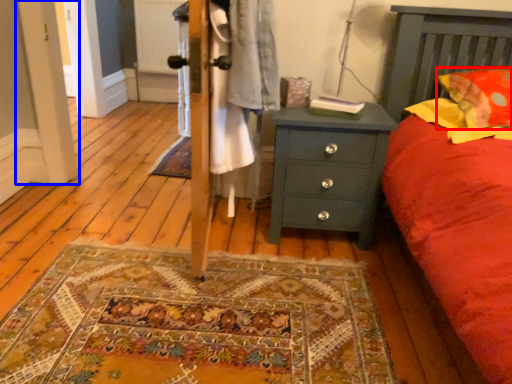
Question: Which object is closer to the camera taking this photo, pillow (highlighted by a red box) or screen door (highlighted by a blue box)?

Choices:
 (A) pillow
 (B) screen door

Answer: (A)